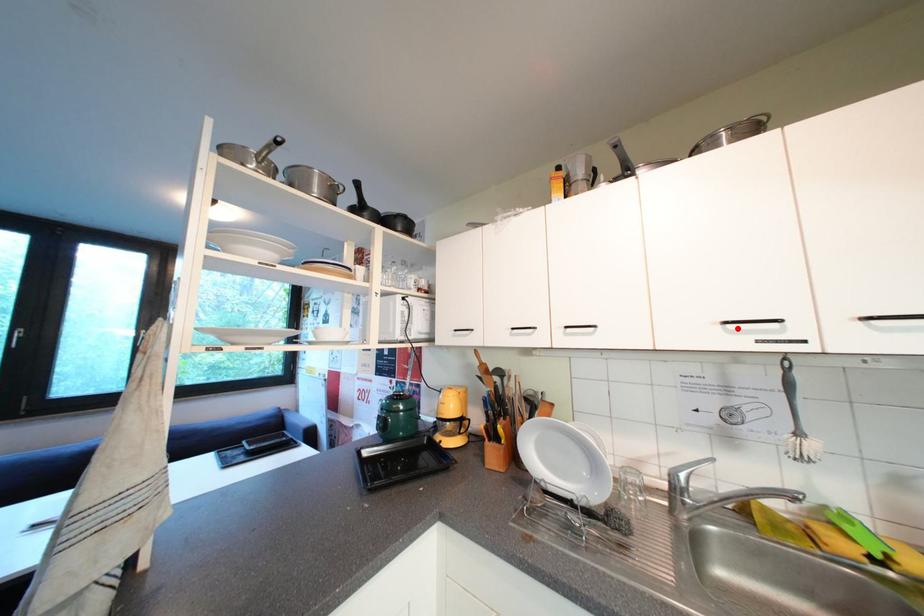
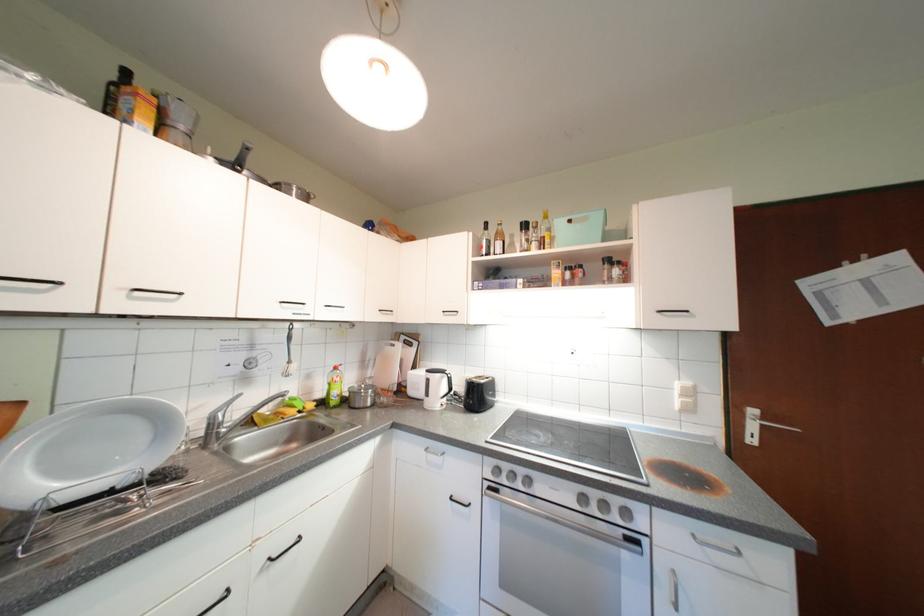
Locate, in the second image, the point that corresponds to the highlighted location in the first image.

(292, 306)